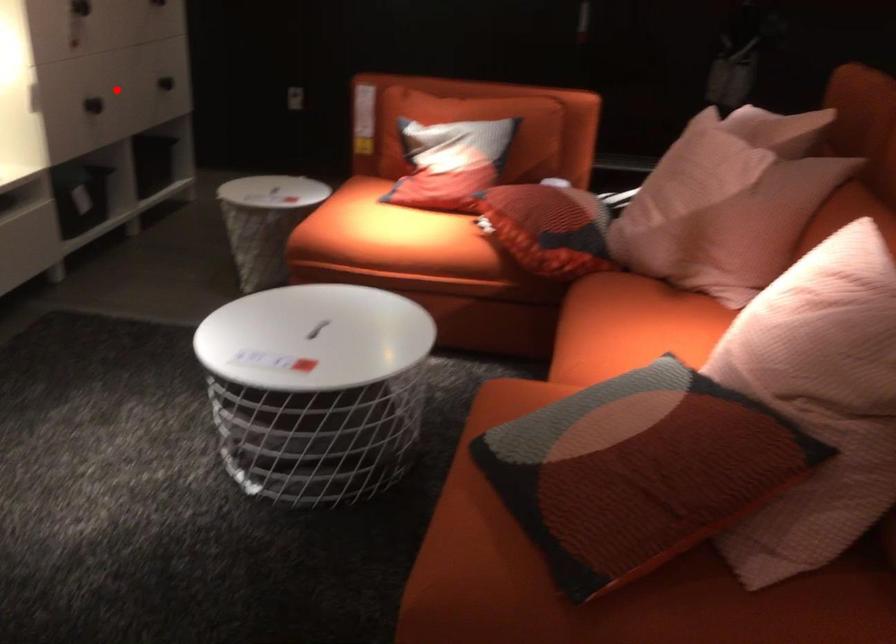
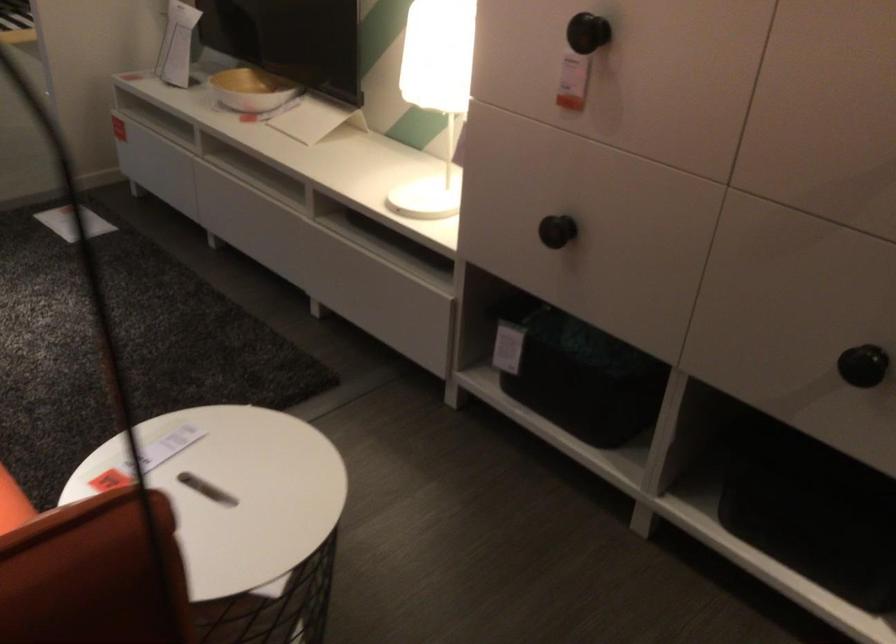
The point at the highlighted location is marked in the first image. Where is the corresponding point in the second image?

(556, 231)